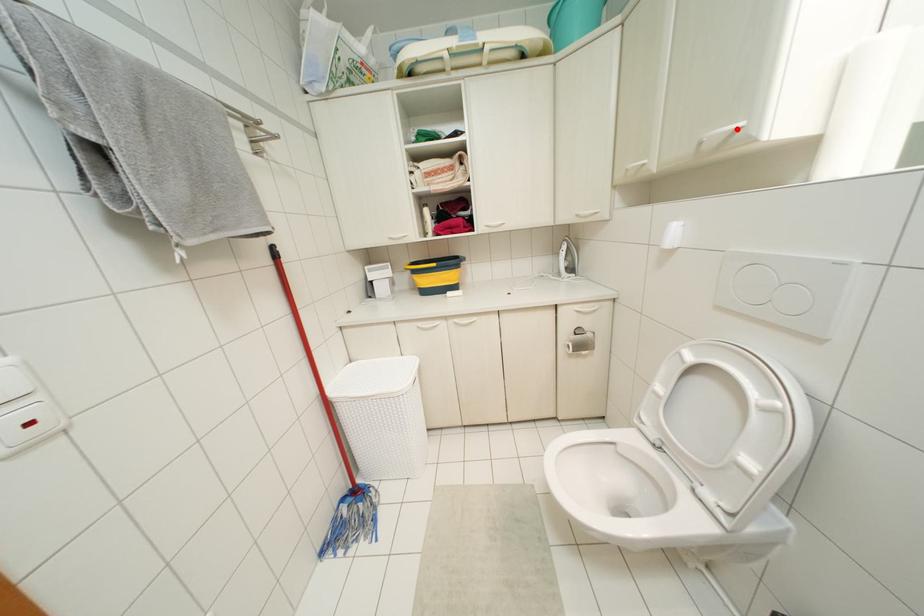
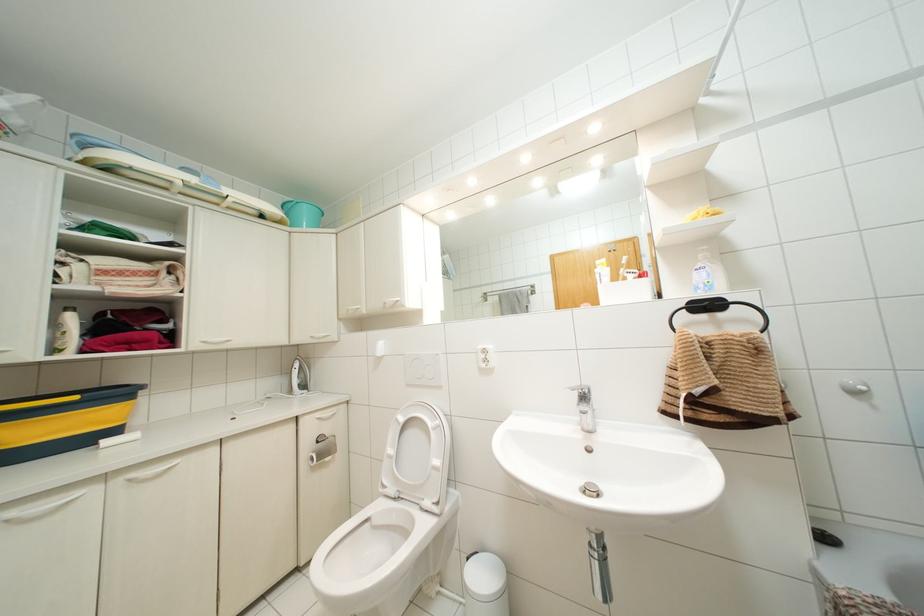
Where in the second image is the point corresponding to the highlighted location from the first image?

(396, 301)